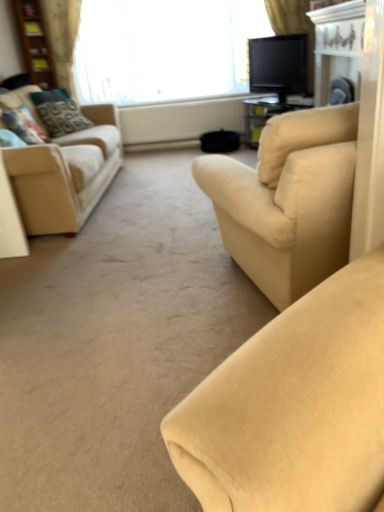
Question: Is beige textured curtain at upper left, which appears as the 1th curtain when viewed from the left, completely or partially inside patterned fabric pillow at left, the 2th pillow from the front?

Choices:
 (A) no
 (B) yes

Answer: (A)

Question: Is patterned fabric pillow at left, placed as the first pillow when sorted from back to front, behind beige textured curtain at upper left, which appears as the 1th curtain when viewed from the left?

Choices:
 (A) no
 (B) yes

Answer: (A)

Question: Is patterned fabric pillow at left, placed as the first pillow when sorted from back to front, outside beige textured curtain at upper left, the 2th curtain from the right?

Choices:
 (A) no
 (B) yes

Answer: (B)

Question: Is patterned fabric pillow at left, placed as the first pillow when sorted from back to front, oriented towards beige textured curtain at upper left, which appears as the 1th curtain when viewed from the left?

Choices:
 (A) yes
 (B) no

Answer: (B)

Question: From the image's perspective, would you say patterned fabric pillow at left, the 2th pillow from the front, is shown under beige textured curtain at upper left, the 2th curtain from the right?

Choices:
 (A) yes
 (B) no

Answer: (A)

Question: Based on their positions, is white textured radiator at center located to the left or right of wooden bookshelf at upper left?

Choices:
 (A) right
 (B) left

Answer: (A)

Question: From a real-world perspective, relative to wooden bookshelf at upper left, is white textured radiator at center vertically above or below?

Choices:
 (A) below
 (B) above

Answer: (A)

Question: From the image's perspective, is white textured radiator at center positioned above or below wooden bookshelf at upper left?

Choices:
 (A) below
 (B) above

Answer: (A)

Question: Considering the positions of white textured radiator at center and wooden bookshelf at upper left in the image, is white textured radiator at center wider or thinner than wooden bookshelf at upper left?

Choices:
 (A) thin
 (B) wide

Answer: (A)

Question: Considering the positions of wooden bookshelf at upper left and white textured radiator at center in the image, is wooden bookshelf at upper left taller or shorter than white textured radiator at center?

Choices:
 (A) tall
 (B) short

Answer: (A)

Question: From the image's perspective, is wooden bookshelf at upper left above or below white textured radiator at center?

Choices:
 (A) above
 (B) below

Answer: (A)

Question: Looking at their shapes, would you say wooden bookshelf at upper left is wider or thinner than white textured radiator at center?

Choices:
 (A) wide
 (B) thin

Answer: (A)

Question: Does point (39, 78) appear closer or farther from the camera than point (142, 110)?

Choices:
 (A) farther
 (B) closer

Answer: (A)

Question: Is point (274, 8) closer or farther from the camera than point (112, 69)?

Choices:
 (A) farther
 (B) closer

Answer: (B)

Question: Considering the relative positions of silky beige curtain at upper center, the 1th curtain when ordered from right to left, and white sheer curtain at upper center in the image provided, is silky beige curtain at upper center, the 1th curtain when ordered from right to left, to the left or to the right of white sheer curtain at upper center?

Choices:
 (A) left
 (B) right

Answer: (B)